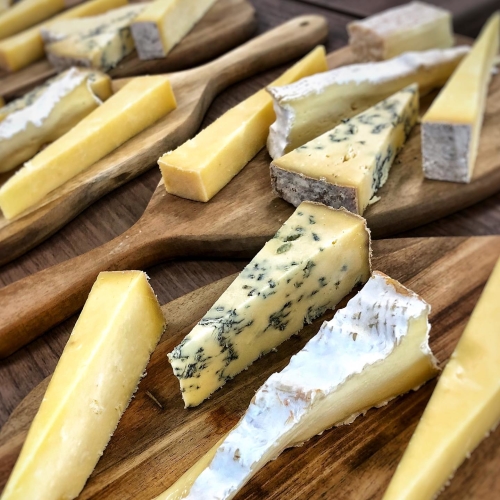
This screenshot has height=500, width=500. In order to click on handle in this screenshot , I will do `click(47, 302)`, `click(276, 41)`.